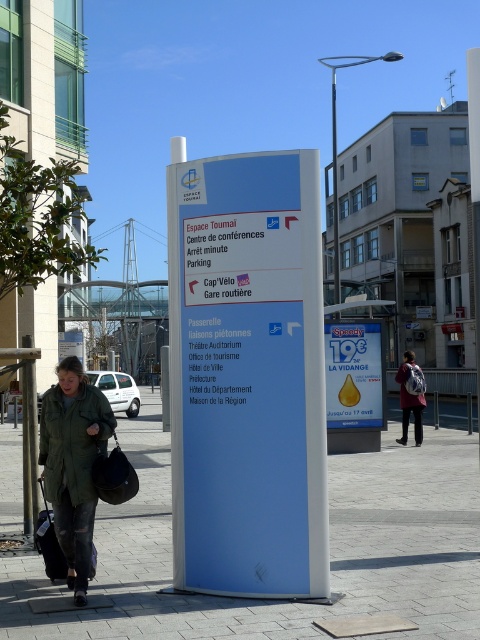
Does blue plastic sign at center come behind yellow paper sign at center?

No, it is in front of yellow paper sign at center.

Which of these two, blue plastic sign at center or yellow paper sign at center, stands shorter?

yellow paper sign at center is shorter.

Does point (226, 582) come in front of point (350, 365)?

Yes, point (226, 582) is in front of point (350, 365).

Where is `blue plastic sign at center`? Image resolution: width=480 pixels, height=640 pixels. blue plastic sign at center is located at coordinates tap(247, 376).

Can you confirm if blue plastic sign at center is bigger than green matte jacket at lower left?

Yes.

Find the location of a particular element. This screenshot has height=640, width=480. blue plastic sign at center is located at coordinates (247, 376).

Who is shorter, green matte coat at lower left or dark green fabric coat at center?

green matte coat at lower left

Where is `green matte coat at lower left`? The width and height of the screenshot is (480, 640). green matte coat at lower left is located at coordinates (72, 442).

The image size is (480, 640). I want to click on green matte coat at lower left, so click(72, 442).